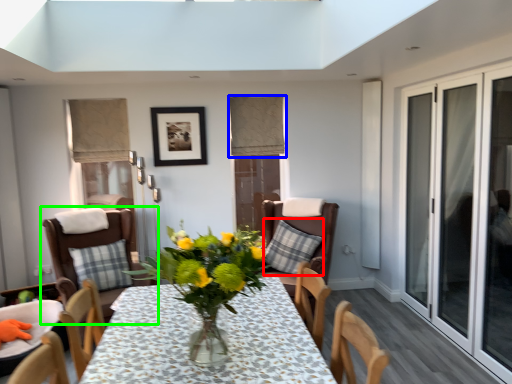
Question: Based on their relative distances, which object is farther from pillow (highlighted by a red box)? Choose from curtain (highlighted by a blue box) and chair (highlighted by a green box).

Choices:
 (A) curtain
 (B) chair

Answer: (B)